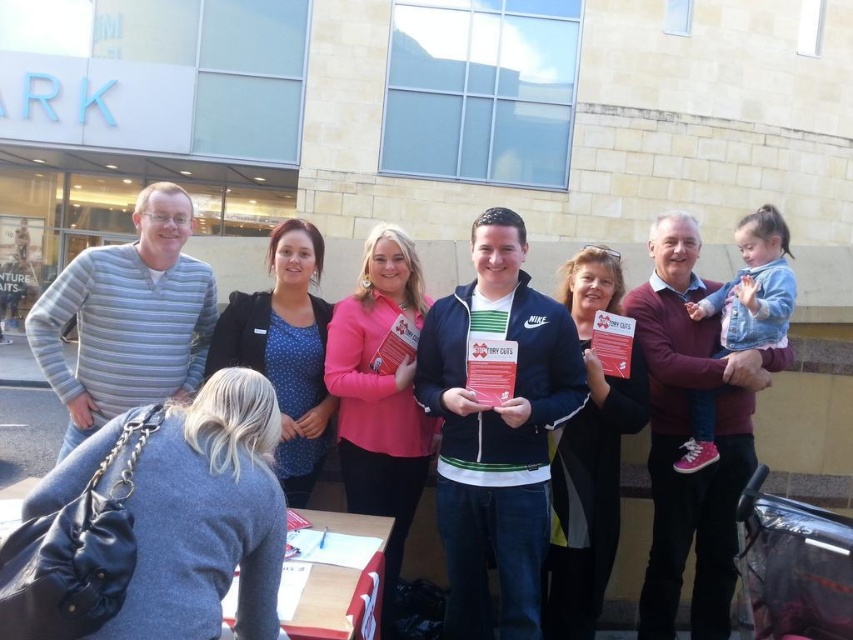
Question: Which object is farther from the camera taking this photo?

Choices:
 (A) maroon sweater at upper right
 (B) striped cotton shirt at center
 (C) gray striped sweater at left

Answer: (A)

Question: Considering the relative positions of maroon sweater at upper right and gray striped sweater at left in the image provided, where is maroon sweater at upper right located with respect to gray striped sweater at left?

Choices:
 (A) below
 (B) above

Answer: (A)

Question: Is striped cotton shirt at center smaller than maroon sweater at upper right?

Choices:
 (A) no
 (B) yes

Answer: (A)

Question: Which point is closer to the camera?

Choices:
 (A) striped cotton shirt at center
 (B) maroon sweater at upper right

Answer: (A)

Question: Is maroon sweater at upper right positioned in front of gray striped sweater at left?

Choices:
 (A) no
 (B) yes

Answer: (A)

Question: Which object is the farthest from the striped cotton shirt at center?

Choices:
 (A) gray striped sweater at left
 (B) maroon sweater at upper right

Answer: (A)